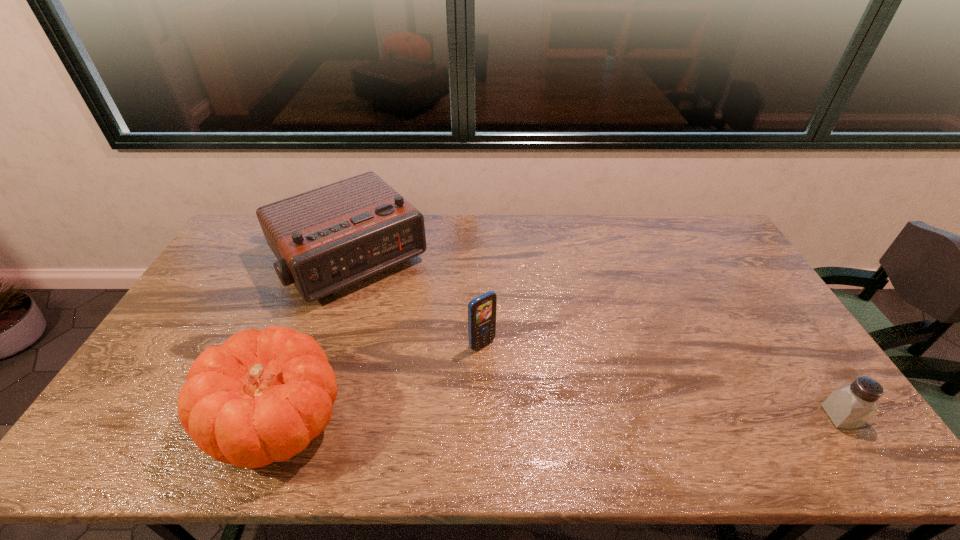
The height and width of the screenshot is (540, 960). Find the location of `vacant spot on the desktop that is between the pumpkin and the saltshaker and is positioned on the screen of the second object from right to left`. vacant spot on the desktop that is between the pumpkin and the saltshaker and is positioned on the screen of the second object from right to left is located at coordinates (550, 418).

Where is `vacant space on the desktop that is between the pumpkin and the shortest object and is positioned on the front panel of the farthest object`? vacant space on the desktop that is between the pumpkin and the shortest object and is positioned on the front panel of the farthest object is located at coordinates (484, 418).